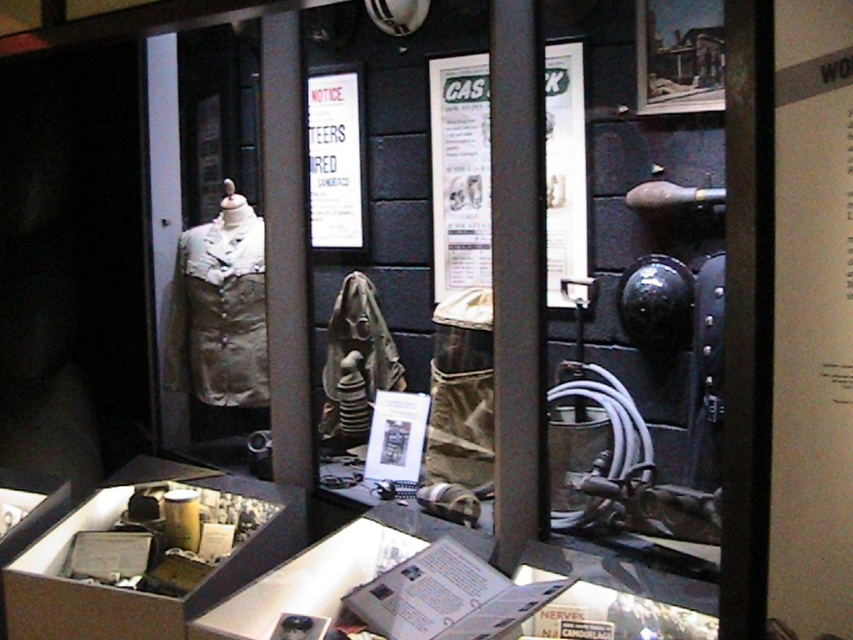
Does point (579, 168) lie behind point (142, 456)?

No, it is in front of (142, 456).

Locate an element on the screen. The height and width of the screenshot is (640, 853). white paper at center is located at coordinates (460, 172).

The width and height of the screenshot is (853, 640). Find the location of `white paper at center`. white paper at center is located at coordinates (460, 172).